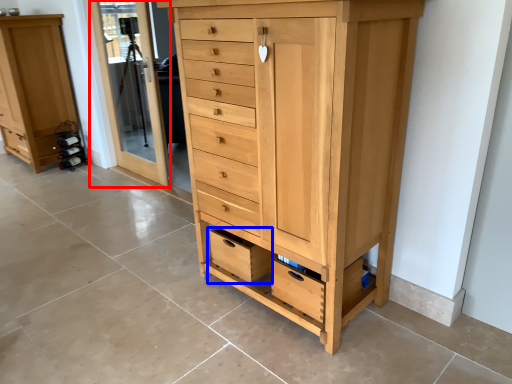
Question: Which of the following is the closest to the observer, screen door (highlighted by a red box) or drawer (highlighted by a blue box)?

Choices:
 (A) screen door
 (B) drawer

Answer: (B)